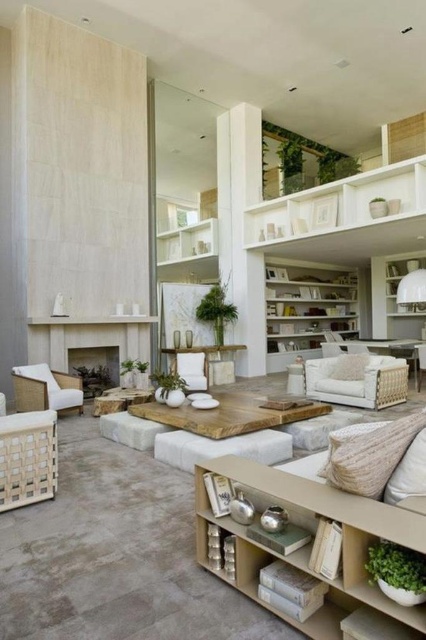
You are planning to place a new rug in the living room. The rug must be large enough to cover both the matte stone fireplace at center and the white fabric armchair at center. Given their sizes, will the rug need to be extra large?

The matte stone fireplace at center is larger in size than the white fabric armchair at center, so the rug will need to be extra large to accommodate both objects.

In the scene shown: You are arranging a new plant in the living room and want to place it on the higher object between the white wood bookshelf at center and the white textured pillow at center. Which object should you choose?

The white wood bookshelf at center has a greater height compared to the white textured pillow at center, so you should place the plant on the white wood bookshelf at center.